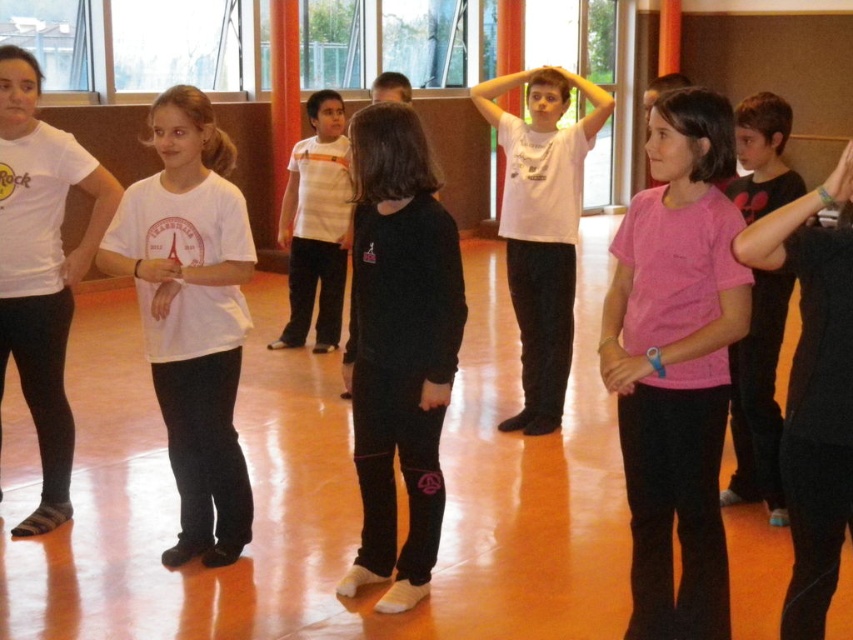
Who is shorter, white matte shirt at left or black matte shirt at right?

Standing shorter between the two is black matte shirt at right.

Image resolution: width=853 pixels, height=640 pixels. What are the coordinates of `white matte shirt at left` in the screenshot? It's located at (190, 316).

You are a GUI agent. You are given a task and a screenshot of the screen. Output one action in this format:
    pyautogui.click(x=<x>, y=<y>)
    Task: Click on the white matte shirt at left
    This screenshot has width=853, height=640.
    Given the screenshot: What is the action you would take?
    pyautogui.click(x=190, y=316)

I want to click on white matte shirt at left, so click(190, 316).

Looking at this image, is black matte pants at center to the left of black matte shirt at right from the viewer's perspective?

Indeed, black matte pants at center is positioned on the left side of black matte shirt at right.

Between black matte pants at center and black matte shirt at right, which one has more height?

Standing taller between the two is black matte pants at center.

Describe the element at coordinates (399, 348) in the screenshot. I see `black matte pants at center` at that location.

You are a GUI agent. You are given a task and a screenshot of the screen. Output one action in this format:
    pyautogui.click(x=<x>, y=<y>)
    Task: Click on the black matte pants at center
    
    Given the screenshot: What is the action you would take?
    pyautogui.click(x=399, y=348)

Can you confirm if black matte pants at center is bigger than white matte t-shirt at center?

Incorrect, black matte pants at center is not larger than white matte t-shirt at center.

From the picture: How far apart are black matte pants at center and white matte t-shirt at center?

2.09 meters

Between point (445, 252) and point (554, 212), which one is positioned in front?

Point (445, 252)

Image resolution: width=853 pixels, height=640 pixels. In order to click on black matte pants at center in this screenshot , I will do `click(399, 348)`.